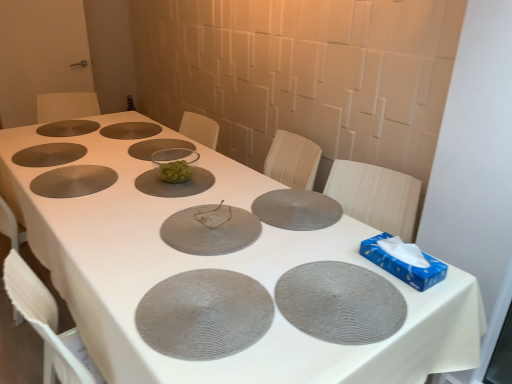
The height and width of the screenshot is (384, 512). Find the location of `free space above matte gray placemat at center, which ranks as the 4th glass plate in front-to-back order (from a real-world perspective)`. free space above matte gray placemat at center, which ranks as the 4th glass plate in front-to-back order (from a real-world perspective) is located at coordinates (301, 204).